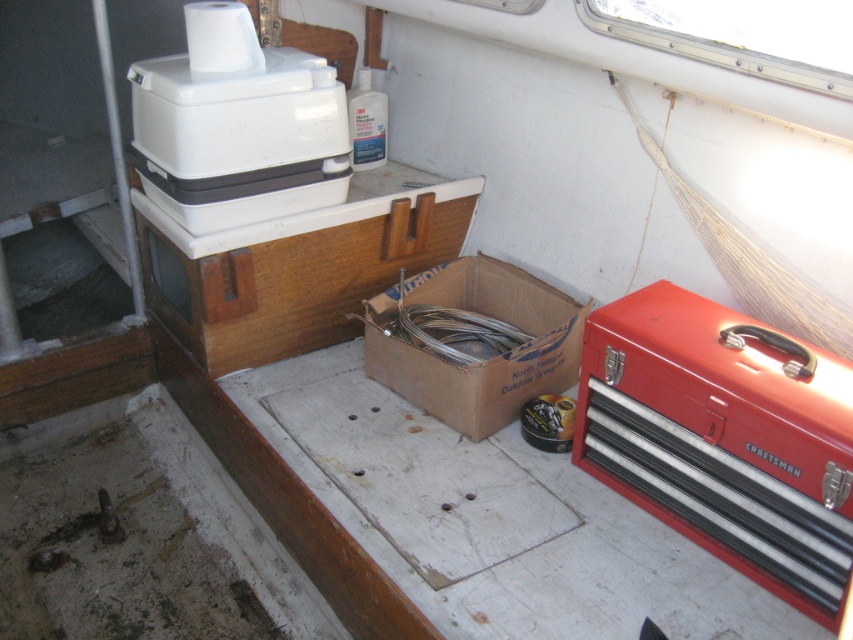
Question: Which point is farther to the camera?

Choices:
 (A) (608, 365)
 (B) (505, 310)

Answer: (B)

Question: Is red metal toolbox at right bigger than brown cardboard box at center?

Choices:
 (A) yes
 (B) no

Answer: (A)

Question: Which point is closer to the camera?

Choices:
 (A) (532, 353)
 (B) (605, 474)
 (C) (334, 99)

Answer: (B)

Question: Which of these objects is positioned farthest from the red metal toolbox at right?

Choices:
 (A) white plastic cooler at upper left
 (B) brown cardboard box at center

Answer: (A)

Question: Is red metal toolbox at right bigger than brown cardboard box at center?

Choices:
 (A) no
 (B) yes

Answer: (B)

Question: Where is red metal toolbox at right located in relation to white plastic cooler at upper left in the image?

Choices:
 (A) above
 (B) below

Answer: (B)